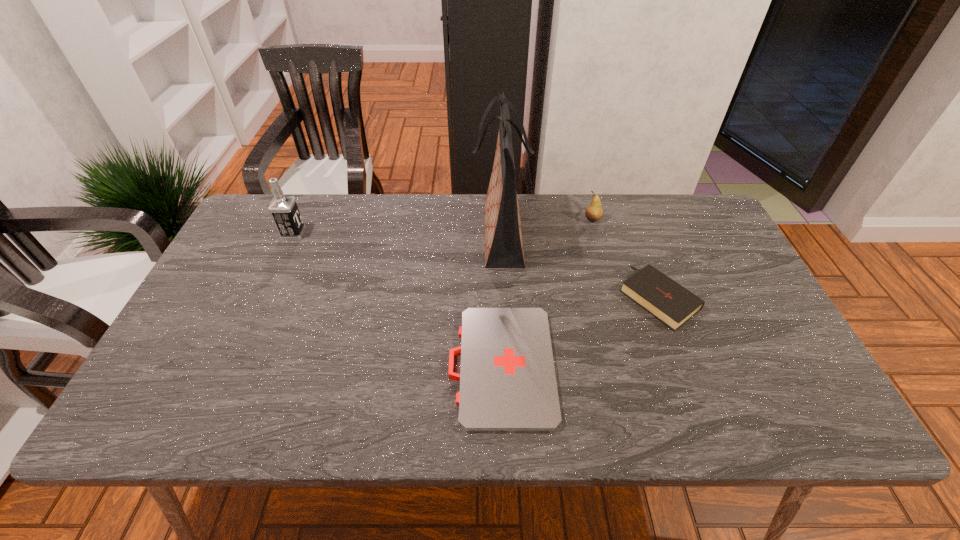
Find the location of a particular element. The height and width of the screenshot is (540, 960). blank area in the image that satisfies the following two spatial constraints: 1. on the front-facing side of the tallest object; 2. on the back side of the Bible is located at coordinates (504, 297).

The height and width of the screenshot is (540, 960). I want to click on vacant region that satisfies the following two spatial constraints: 1. on the front label of the vodka; 2. on the left side of the Bible, so click(x=265, y=297).